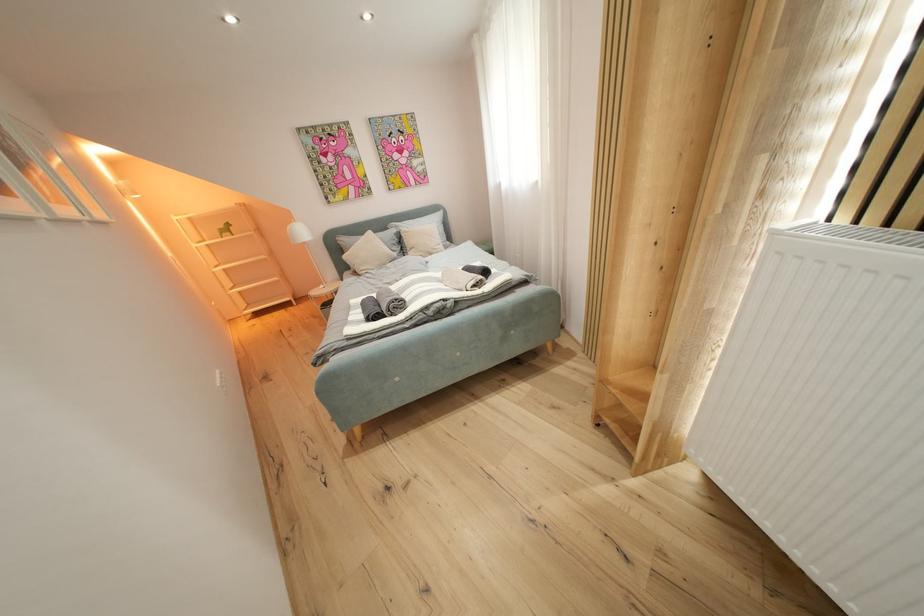
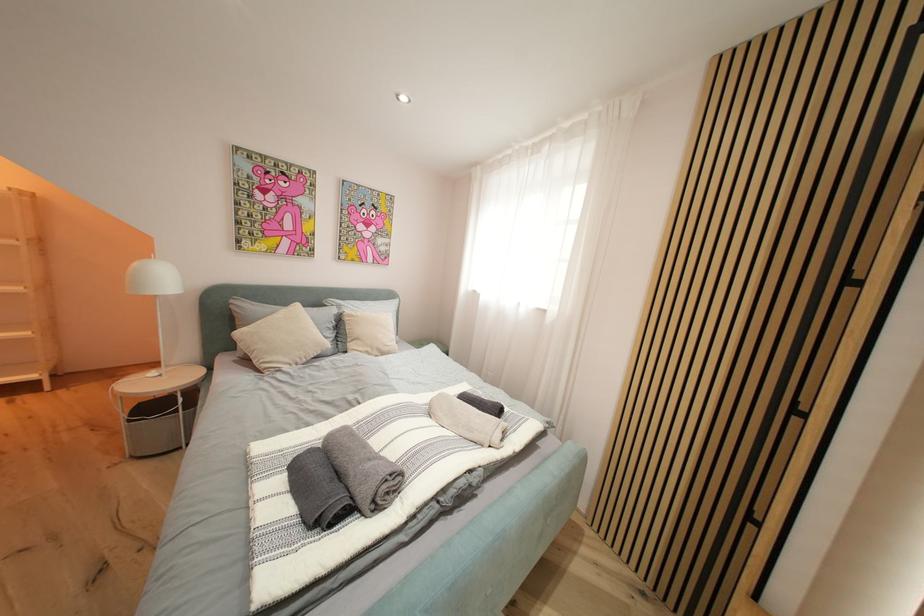
First-person continuous shooting, in which direction is the camera rotating?

The camera rotated toward right-up.